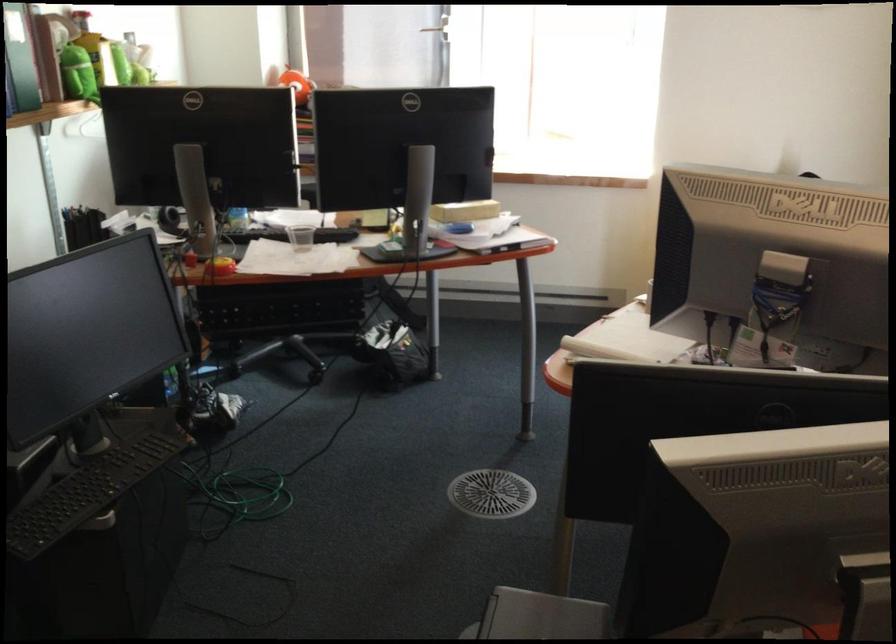
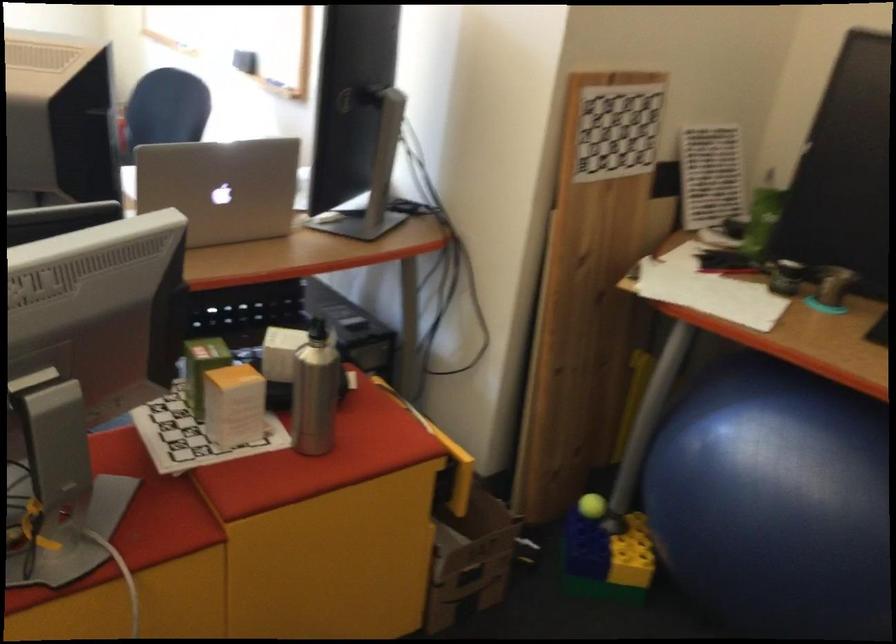
Question: Based on the continuous images, in which direction is the camera rotating? Reply with the corresponding letter.

Choices:
 (A) Left
 (B) Right
 (C) Up
 (D) Down

Answer: (B)